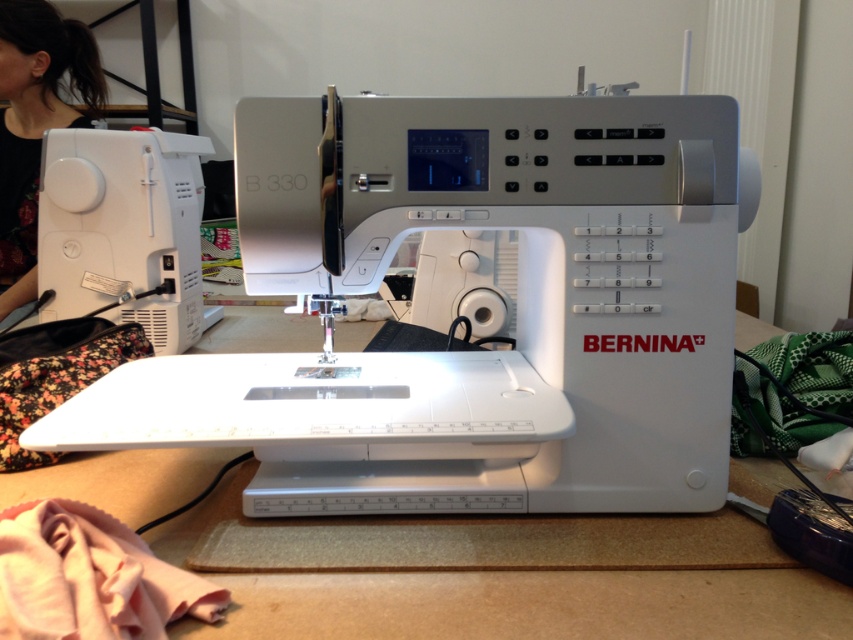
Question: Considering the real-world distances, which object is closest to the black fabric at upper left?

Choices:
 (A) white plastic sewing machine at center
 (B) white matte table at center

Answer: (A)

Question: Among these points, which one is farthest from the camera?

Choices:
 (A) (271, 598)
 (B) (160, 321)
 (C) (38, 147)

Answer: (C)

Question: Among these objects, which one is farthest from the camera?

Choices:
 (A) black fabric at upper left
 (B) white matte table at center

Answer: (A)

Question: Does white matte table at center have a smaller size compared to white plastic sewing machine at left?

Choices:
 (A) no
 (B) yes

Answer: (A)

Question: In this image, where is white plastic sewing machine at center located relative to white plastic sewing machine at left?

Choices:
 (A) right
 (B) left

Answer: (A)

Question: Does white matte table at center appear on the left side of white plastic sewing machine at left?

Choices:
 (A) yes
 (B) no

Answer: (B)